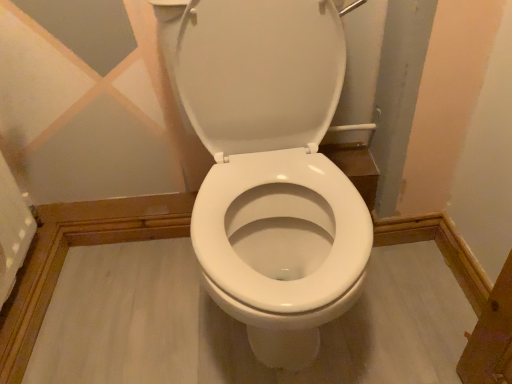
In order to click on vacant space to the left of white glossy toilet at center in this screenshot , I will do `click(130, 305)`.